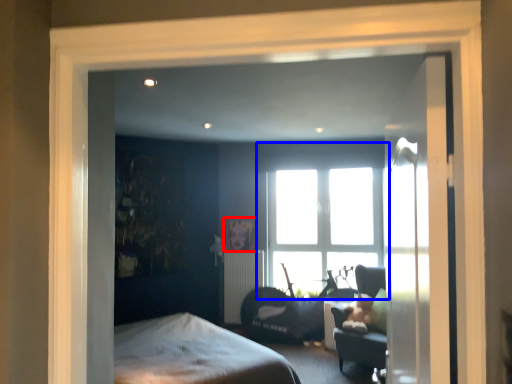
Question: Which object is further to the camera taking this photo, picture frame (highlighted by a red box) or window (highlighted by a blue box)?

Choices:
 (A) picture frame
 (B) window

Answer: (A)